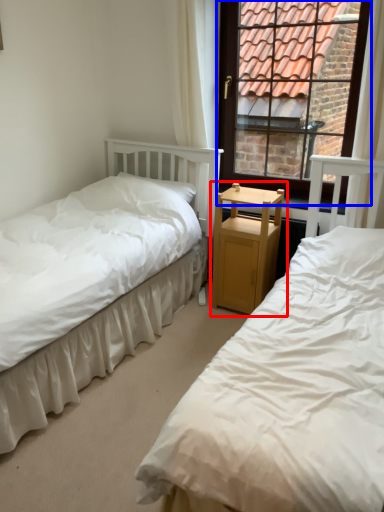
Question: Which of the following is the closest to the observer, nightstand (highlighted by a red box) or window (highlighted by a blue box)?

Choices:
 (A) nightstand
 (B) window

Answer: (B)